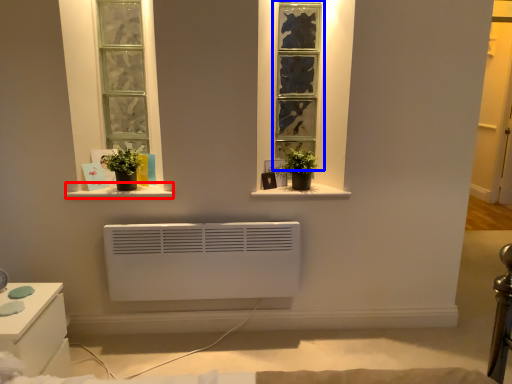
Question: Which point is closer to the camera, window sill (highlighted by a red box) or window (highlighted by a blue box)?

Choices:
 (A) window sill
 (B) window

Answer: (A)